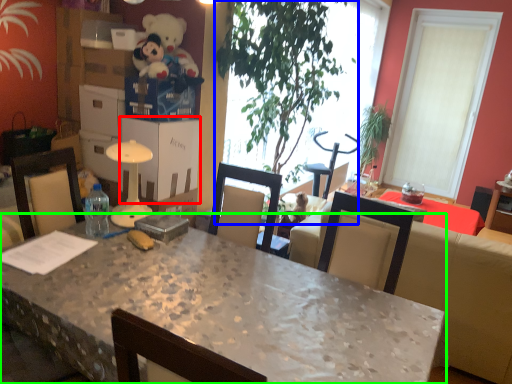
Question: Based on their relative distances, which object is farther from cardboard box (highlighted by a red box)? Choose from houseplant (highlighted by a blue box) and desk (highlighted by a green box).

Choices:
 (A) houseplant
 (B) desk

Answer: (B)